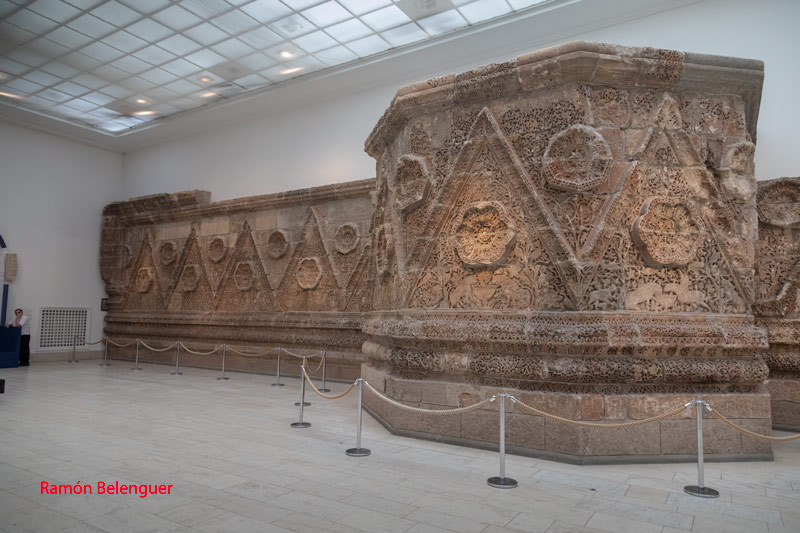
This screenshot has width=800, height=533. I want to click on vent, so click(x=50, y=314).